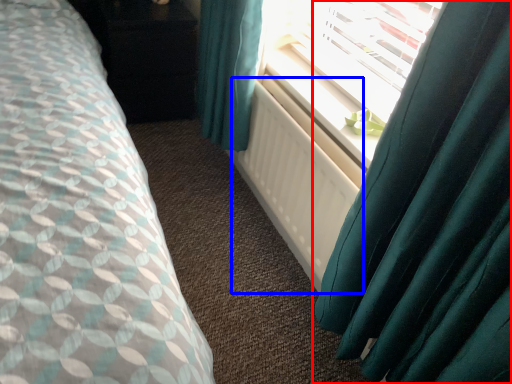
Question: Which of the following is the closest to the observer, curtain (highlighted by a red box) or radiator (highlighted by a blue box)?

Choices:
 (A) curtain
 (B) radiator

Answer: (A)